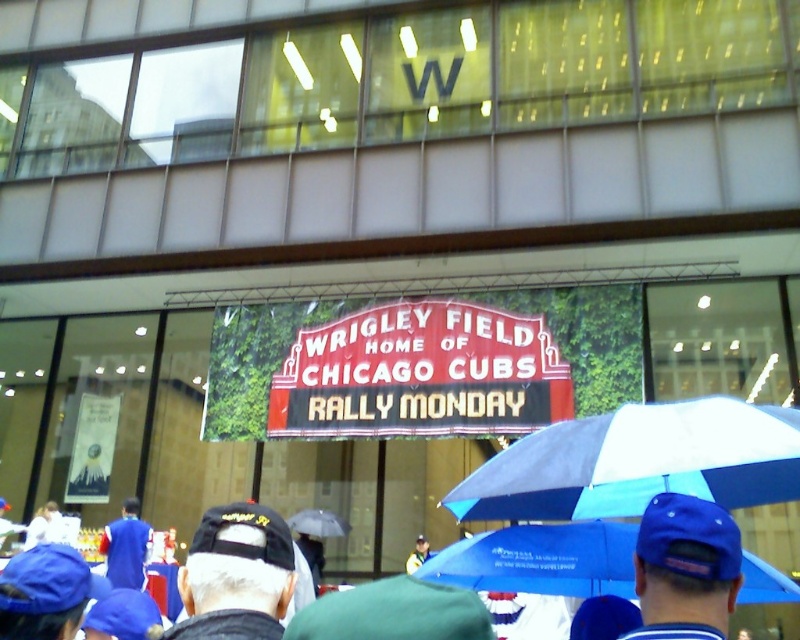
Question: Considering the relative positions of blue fabric umbrella at lower center and black fabric cap at lower left in the image provided, where is blue fabric umbrella at lower center located with respect to black fabric cap at lower left?

Choices:
 (A) above
 (B) below

Answer: (B)

Question: Which of the following is the farthest from the observer?

Choices:
 (A) (230, 616)
 (B) (644, 572)
 (C) (744, 412)

Answer: (C)

Question: Is blue fabric umbrella at center above transparent plastic umbrella at center?

Choices:
 (A) no
 (B) yes

Answer: (B)

Question: Which of the following is the closest to the observer?

Choices:
 (A) (674, 544)
 (B) (420, 545)
 (C) (132, 534)

Answer: (A)

Question: In this image, where is blue fabric umbrella at center located relative to blue fabric jacket at lower left?

Choices:
 (A) right
 (B) left

Answer: (A)

Question: Which of these objects is positioned farthest from the blue fabric cap at center?

Choices:
 (A) transparent plastic umbrella at center
 (B) blue fabric umbrella at center
 (C) blue fabric cap at lower center
 (D) blue fabric jacket at lower left

Answer: (C)